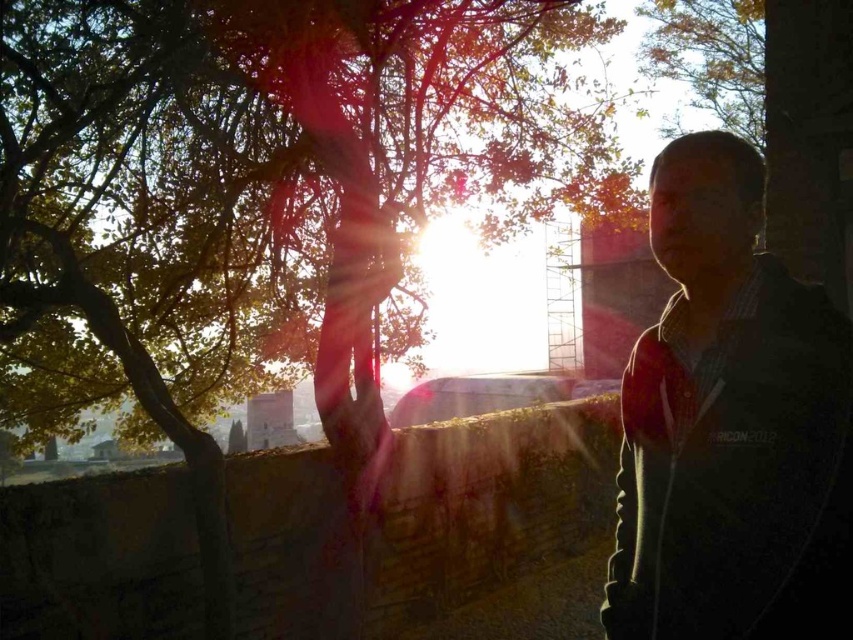
Question: Which point is farther from the camera taking this photo?

Choices:
 (A) click(837, 369)
 (B) click(671, 74)

Answer: (B)

Question: Is dark green textured jacket at right positioned before yellow-green leaves at upper center?

Choices:
 (A) no
 (B) yes

Answer: (B)

Question: Does dark green textured jacket at right appear on the right side of yellow-green leaves at upper center?

Choices:
 (A) no
 (B) yes

Answer: (A)

Question: Does dark green textured jacket at right have a smaller size compared to yellow-green leaves at upper center?

Choices:
 (A) yes
 (B) no

Answer: (A)

Question: Which point appears farthest from the camera in this image?

Choices:
 (A) (714, 74)
 (B) (733, 584)

Answer: (A)